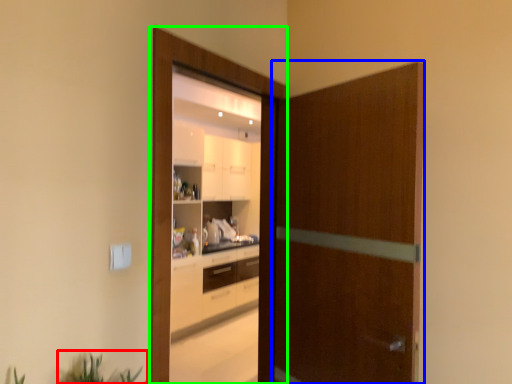
Question: Which object is positioned closest to plant (highlighted by a red box)? Select from screen door (highlighted by a blue box) and screen door (highlighted by a green box).

Choices:
 (A) screen door
 (B) screen door

Answer: (B)